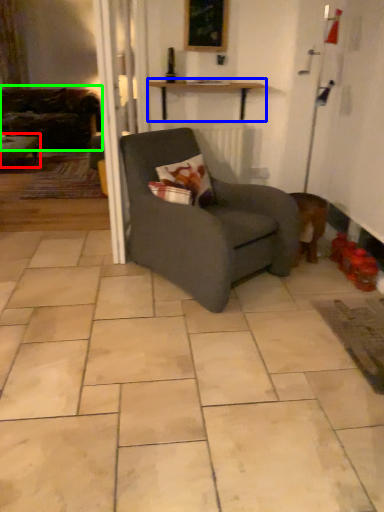
Question: Based on their relative distances, which object is nearer to table (highlighted by a red box)? Choose from table (highlighted by a blue box) and studio couch (highlighted by a green box).

Choices:
 (A) table
 (B) studio couch

Answer: (B)